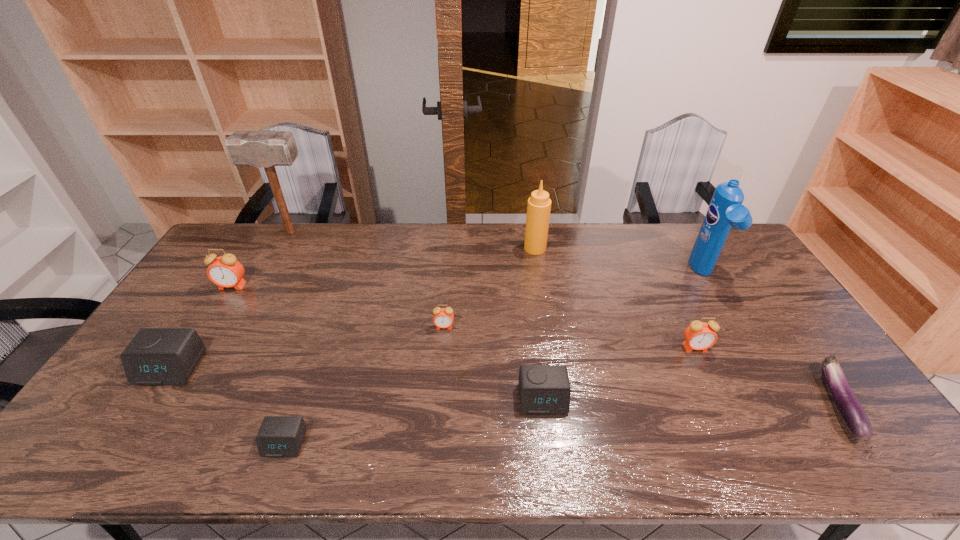
At what (x,y) coordinates should I click in order to perform the action: click on alarm clock at the near edge. Please return your answer as a coordinate pair (x, y). This screenshot has width=960, height=540. Looking at the image, I should click on [x=279, y=436].

At what (x,y) coordinates should I click in order to perform the action: click on eggplant located at the near edge. Please return your answer as a coordinate pair (x, y). Image resolution: width=960 pixels, height=540 pixels. Looking at the image, I should click on (849, 409).

Identify the location of mallet that is at the left edge. This screenshot has width=960, height=540. (266, 149).

At what (x,y) coordinates should I click in order to perform the action: click on shampoo that is positioned at the right edge. Please return your answer as a coordinate pair (x, y). Looking at the image, I should click on (725, 210).

The image size is (960, 540). In order to click on eggplant present at the right edge in this screenshot , I will do `click(849, 409)`.

Locate an element on the screen. The image size is (960, 540). object located in the far left corner section of the desktop is located at coordinates (266, 149).

In order to click on object that is at the far right corner in this screenshot , I will do `click(725, 210)`.

The width and height of the screenshot is (960, 540). Identify the location of object present at the near right corner. (849, 409).

Where is `free space at the far edge`? This screenshot has height=540, width=960. free space at the far edge is located at coordinates (561, 234).

The height and width of the screenshot is (540, 960). I want to click on free space at the near edge, so click(x=702, y=434).